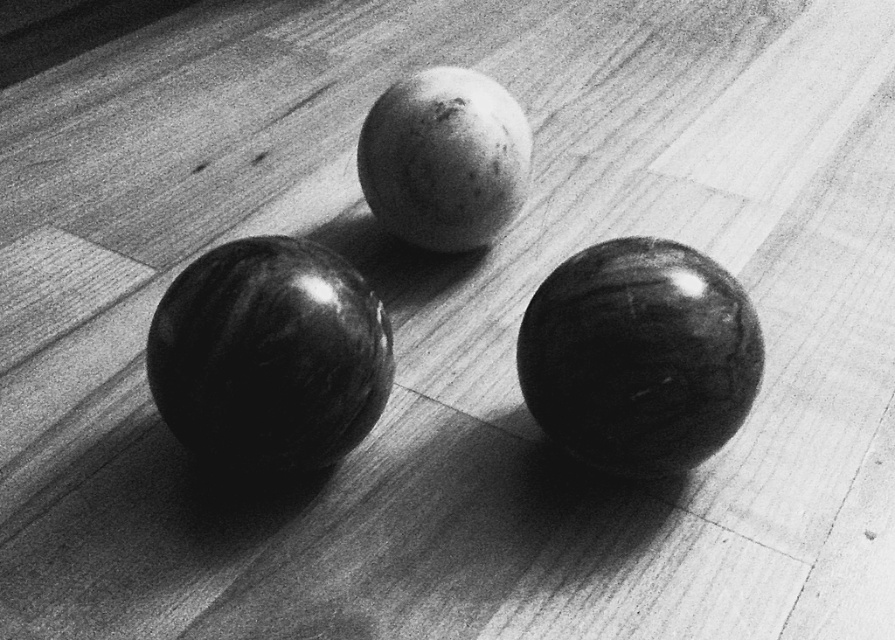
You are standing at the origin point of the coordinate system where the image is displayed. The glossy black bowling ball at lower right is located at point 0.556, 0.715. If you want to move directly towards it, in which direction should you move?

You should move towards the lower right direction to reach the glossy black bowling ball at lower right located at point [638,355].

You are arranging these two bowling balls on a shelf. The shiny black bowling ball at center and the glossy black bowling ball at lower right. If you want to place them side by side, which one should be placed higher to match their current positions in the image?

The shiny black bowling ball at center should be placed higher since it is positioned above the glossy black bowling ball at lower right in the image.